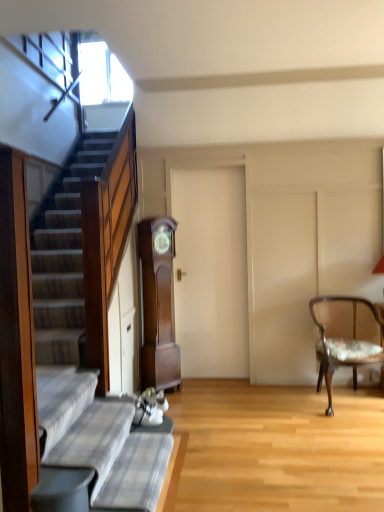
Identify the location of space that is in front of wooden cane chair with floral cushion at right. Image resolution: width=384 pixels, height=512 pixels. (350, 431).